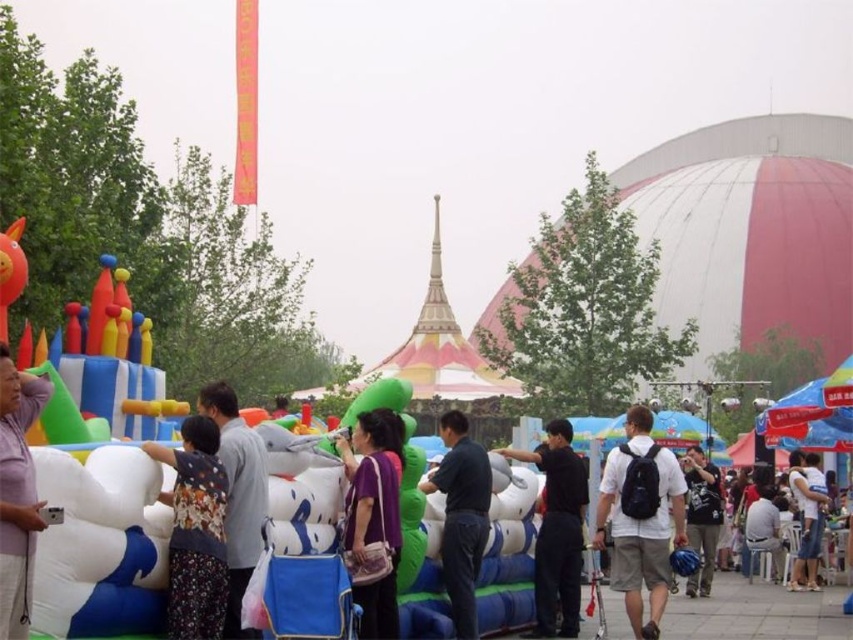
Question: From the image, what is the correct spatial relationship of black matte shirt at center in relation to white fabric chair at lower right?

Choices:
 (A) left
 (B) right

Answer: (A)

Question: Among these objects, which one is nearest to the camera?

Choices:
 (A) floral fabric dress at center
 (B) white cotton shirt at center
 (C) purple fabric bag at center

Answer: (A)

Question: Is dark blue backpack at center closer to camera compared to white fabric chair at lower right?

Choices:
 (A) yes
 (B) no

Answer: (A)

Question: Does white matte backpack at right appear on the right side of dark blue backpack at center?

Choices:
 (A) no
 (B) yes

Answer: (A)

Question: Among these objects, which one is farthest from the camera?

Choices:
 (A) dark blue shirt at center
 (B) pink matte shirt at left
 (C) purple fabric bag at center
 (D) dark blue backpack at center

Answer: (D)

Question: Which object is closer to the camera taking this photo?

Choices:
 (A) white fabric chair at lower right
 (B) black matte shirt at center
 (C) dark blue backpack at center
 (D) dark blue shirt at center

Answer: (D)